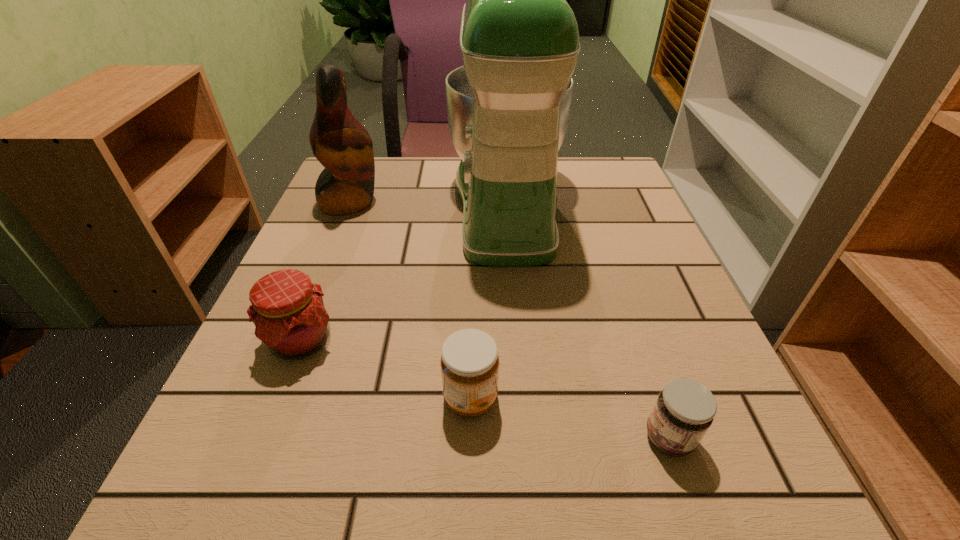
Image resolution: width=960 pixels, height=540 pixels. In order to click on jam at the left edge in this screenshot , I will do `click(288, 311)`.

Where is `object located in the right edge section of the desktop`? The image size is (960, 540). object located in the right edge section of the desktop is located at coordinates (685, 409).

Find the location of a particular element. The image size is (960, 540). object present at the far left corner is located at coordinates click(339, 141).

Identify the location of object that is at the near right corner. The width and height of the screenshot is (960, 540). (685, 409).

Where is `free space at the far edge of the desktop`? free space at the far edge of the desktop is located at coordinates (419, 192).

Where is `vacant space at the near edge`? Image resolution: width=960 pixels, height=540 pixels. vacant space at the near edge is located at coordinates (325, 465).

Where is `vacant space at the left edge`? Image resolution: width=960 pixels, height=540 pixels. vacant space at the left edge is located at coordinates (263, 444).

The image size is (960, 540). Identify the location of vacant region at the right edge of the desktop. (608, 239).

Identify the location of vacant area that lies between the tallest object and the second jam from right to left. This screenshot has height=540, width=960. (489, 301).

The width and height of the screenshot is (960, 540). Identify the location of free point between the parrot and the tallest object. (428, 203).